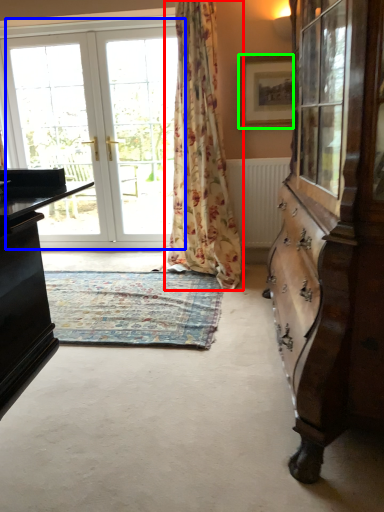
Question: Which is nearer to the curtain (highlighted by a red box)? door (highlighted by a blue box) or picture frame (highlighted by a green box).

Choices:
 (A) door
 (B) picture frame

Answer: (B)